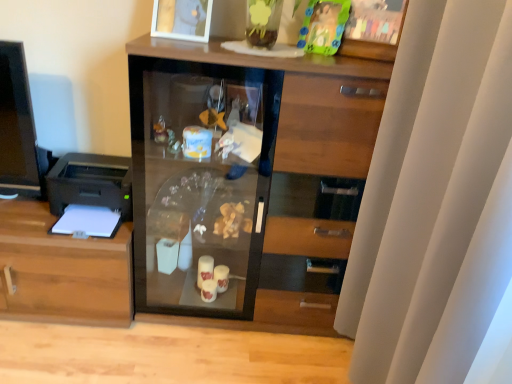
Where is `transparent glass cabinet at center`? This screenshot has width=512, height=384. transparent glass cabinet at center is located at coordinates (244, 178).

Describe the element at coordinates (182, 19) in the screenshot. I see `white glossy picture frame at upper center` at that location.

You are a GUI agent. You are given a task and a screenshot of the screen. Output one action in this format:
    pyautogui.click(x=<x>, y=<y>)
    Task: Click on the translucent plastic toy at upper center
    This screenshot has height=384, width=512.
    Given the screenshot: What is the action you would take?
    pyautogui.click(x=323, y=26)

Identify the location of transparent glass cabinet at center. (244, 178).

Based on their sizes in the image, would you say black plastic printer at left is bigger or smaller than transparent glass cabinet at center?

In the image, black plastic printer at left appears to be smaller than transparent glass cabinet at center.

Locate an element on the screen. The image size is (512, 384). printer that is under the transparent glass cabinet at center (from a real-world perspective) is located at coordinates (91, 189).

Between black plastic printer at left and transparent glass cabinet at center, which one has larger width?

transparent glass cabinet at center.

Could you tell me if white glossy picture frame at upper center is facing transparent glass cabinet at center?

No, white glossy picture frame at upper center is not aimed at transparent glass cabinet at center.

Is white glossy picture frame at upper center completely or partially outside of transparent glass cabinet at center?

Yes, white glossy picture frame at upper center is located beyond the bounds of transparent glass cabinet at center.

From the picture: Does white glossy picture frame at upper center have a lesser width compared to transparent glass cabinet at center?

Indeed, white glossy picture frame at upper center has a lesser width compared to transparent glass cabinet at center.

Could you measure the distance between white glossy picture frame at upper center and transparent glass cabinet at center?

white glossy picture frame at upper center is 22.25 inches from transparent glass cabinet at center.

Do you think wooden cabinet at left is within white glossy picture frame at upper center, or outside of it?

The correct answer is: outside.

Find the location of a particular element. cabinetry that appears on the left of white glossy picture frame at upper center is located at coordinates (62, 271).

Does point (25, 247) appear closer or farther from the camera than point (188, 39)?

Point (25, 247) is farther from the camera than point (188, 39).

From a real-world perspective, which object rests below the other?

In real-world perspective, wooden cabinet at left is lower.

Can you tell me how much black plastic printer at left and wooden cabinet at left differ in facing direction?

0.599 degrees.

From the image's perspective, which one is positioned lower, black plastic printer at left or wooden cabinet at left?

wooden cabinet at left is shown below in the image.

Considering the sizes of black plastic printer at left and wooden cabinet at left in the image, is black plastic printer at left taller or shorter than wooden cabinet at left?

In the image, black plastic printer at left appears to be shorter than wooden cabinet at left.

Which object is further away from the camera taking this photo, black plastic printer at left or wooden cabinet at left?

wooden cabinet at left is behind.

How different are the orientations of translucent plastic toy at upper center and white matte curtain at right in degrees?

The angle between the facing direction of translucent plastic toy at upper center and the facing direction of white matte curtain at right is 63 degrees.

Is translucent plastic toy at upper center in contact with white matte curtain at right?

No, translucent plastic toy at upper center is not beside white matte curtain at right.

Is translucent plastic toy at upper center to the left of white matte curtain at right from the viewer's perspective?

Correct, you'll find translucent plastic toy at upper center to the left of white matte curtain at right.

From a real-world perspective, who is located higher, translucent plastic toy at upper center or white matte curtain at right?

translucent plastic toy at upper center is physically above.

Is transparent glass cabinet at center aimed at translucent plastic toy at upper center?

No, transparent glass cabinet at center is not facing towards translucent plastic toy at upper center.

Is transparent glass cabinet at center not within translucent plastic toy at upper center?

Yes, transparent glass cabinet at center is located beyond the bounds of translucent plastic toy at upper center.

From the image's perspective, does transparent glass cabinet at center appear lower than translucent plastic toy at upper center?

Indeed, from the image's perspective, transparent glass cabinet at center is shown beneath translucent plastic toy at upper center.

Is point (203, 53) positioned in front of point (323, 31)?

Yes, point (203, 53) is closer to viewer.

Is transparent glass cabinet at center not within wooden cabinet at left?

Yes, transparent glass cabinet at center is outside of wooden cabinet at left.

Considering the points (190, 91) and (2, 239), which point is in front, point (190, 91) or point (2, 239)?

The point (2, 239) is closer to the camera.

Is transparent glass cabinet at center placed right next to wooden cabinet at left?

No, transparent glass cabinet at center is not beside wooden cabinet at left.

The image size is (512, 384). In the image, there is a transparent glass cabinet at center. Identify the location of printer above it (from the image's perspective). (91, 189).

Locate an element on the screen. picture frame above the transparent glass cabinet at center (from a real-world perspective) is located at coordinates (182, 19).

From the image, which object appears to be nearer to black plastic printer at left, transparent glass cabinet at center or wooden cabinet at left?

Based on the image, wooden cabinet at left appears to be nearer to black plastic printer at left.

Estimate the real-world distances between objects in this image. Which object is closer to translucent plastic toy at upper center, white glossy picture frame at upper center or transparent glass cabinet at center?

white glossy picture frame at upper center.

When comparing their distances from transparent glass cabinet at center, does white glossy picture frame at upper center or white matte curtain at right seem closer?

white matte curtain at right is closer to transparent glass cabinet at center.

From the image, which object appears to be nearer to transparent glass cabinet at center, white matte curtain at right or white glossy picture frame at upper center?

white matte curtain at right lies closer to transparent glass cabinet at center than the other object.

In the scene shown: Estimate the real-world distances between objects in this image. Which object is further from white matte curtain at right, black plastic printer at left or white glossy picture frame at upper center?

The object further to white matte curtain at right is black plastic printer at left.

Based on their spatial positions, is white matte curtain at right or white glossy picture frame at upper center further from black plastic printer at left?

The object further to black plastic printer at left is white matte curtain at right.

Looking at the image, which one is located further to white matte curtain at right, white glossy picture frame at upper center or wooden cabinet at left?

wooden cabinet at left is further to white matte curtain at right.

When comparing their distances from wooden cabinet at left, does white matte curtain at right or white glossy picture frame at upper center seem closer?

Among the two, white glossy picture frame at upper center is located nearer to wooden cabinet at left.

Identify the location of printer between white glossy picture frame at upper center and transparent glass cabinet at center in the vertical direction. This screenshot has height=384, width=512. (91, 189).

Locate an element on the screen. Image resolution: width=512 pixels, height=384 pixels. printer located between wooden cabinet at left and translucent plastic toy at upper center in the left-right direction is located at coordinates (91, 189).

The image size is (512, 384). I want to click on toy between white glossy picture frame at upper center and transparent glass cabinet at center in the up-down direction, so click(x=323, y=26).

Locate an element on the screen. picture frame between black plastic printer at left and white matte curtain at right from left to right is located at coordinates (182, 19).